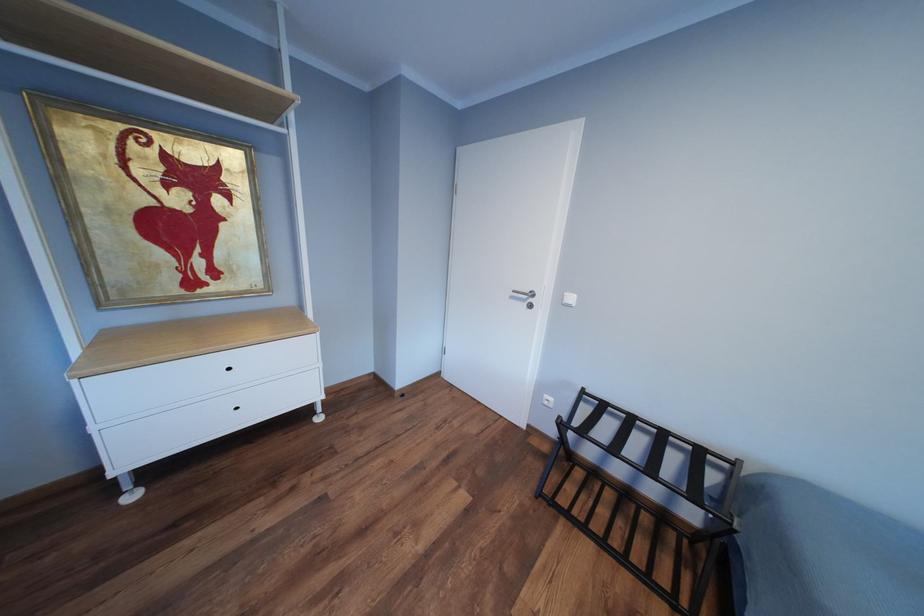
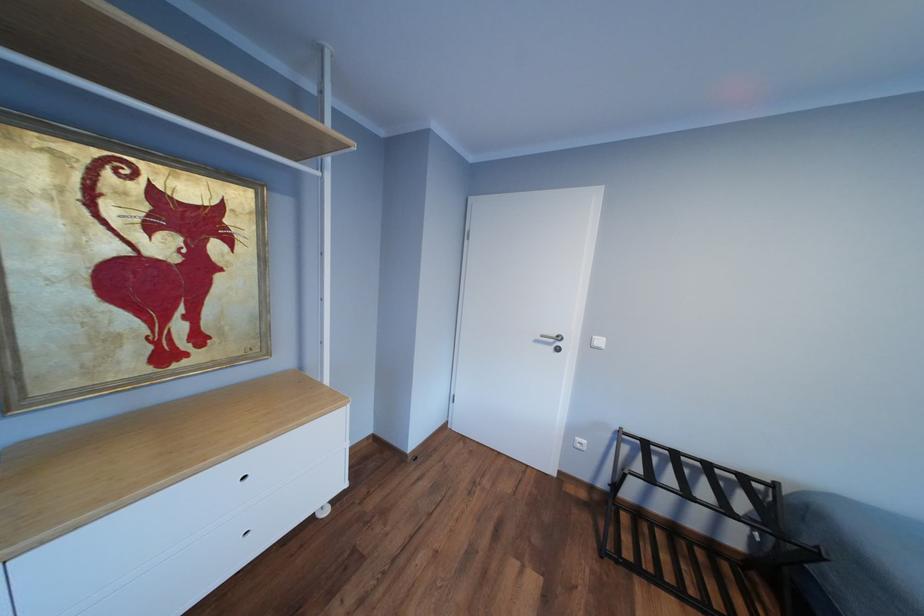
Question: What movement of the cameraman would produce the second image?

Choices:
 (A) Left
 (B) Right
 (C) Forward
 (D) Backward

Answer: (A)